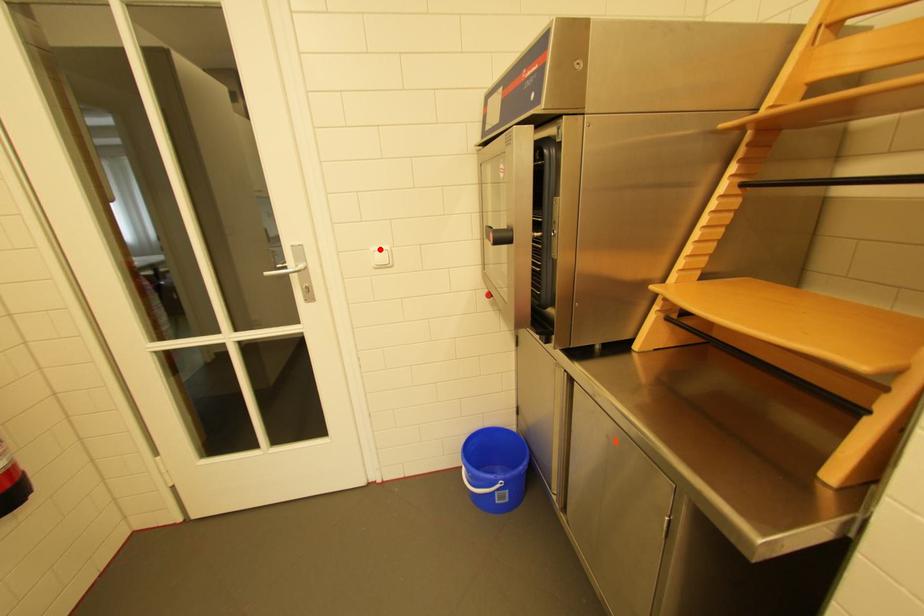
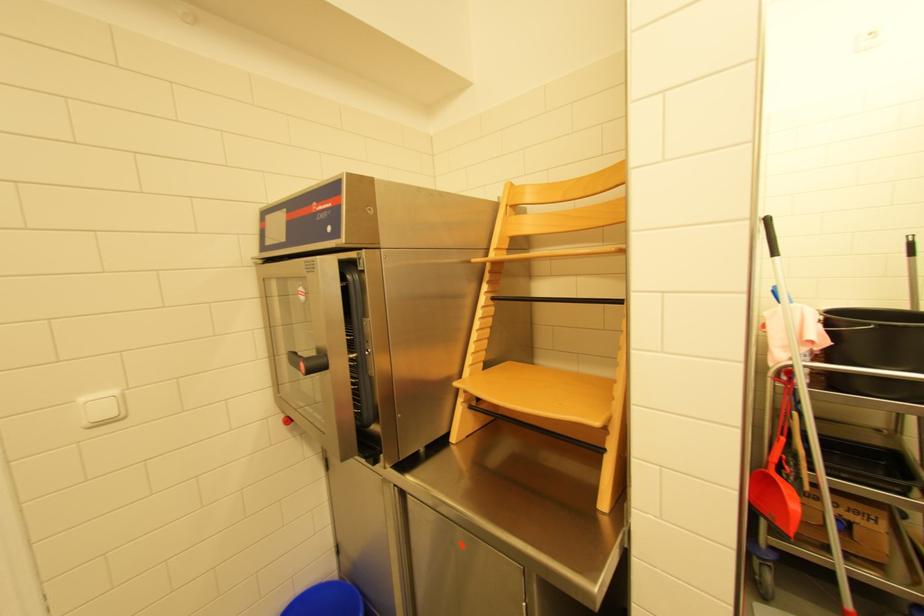
Question: I am providing you with two images of the same scene from different viewpoints. A red point is marked on the first image. Can you still see the location of the red point in image 2?

Choices:
 (A) Yes
 (B) No

Answer: (A)